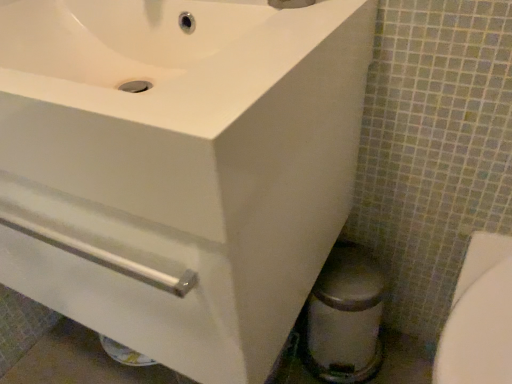
Question: From the image's perspective, is white glossy sink at upper left above or below brushed metal faucet at upper center?

Choices:
 (A) above
 (B) below

Answer: (B)

Question: Considering the positions of white glossy sink at upper left and brushed metal faucet at upper center in the image, is white glossy sink at upper left wider or thinner than brushed metal faucet at upper center?

Choices:
 (A) wide
 (B) thin

Answer: (A)

Question: Estimate the real-world distances between objects in this image. Which object is closer to the white glossy sink at upper left?

Choices:
 (A) brushed metal faucet at upper center
 (B) white glossy bidet at lower right

Answer: (A)

Question: Which is nearer to the white glossy bidet at lower right?

Choices:
 (A) white glossy sink at upper left
 (B) brushed metal faucet at upper center

Answer: (A)